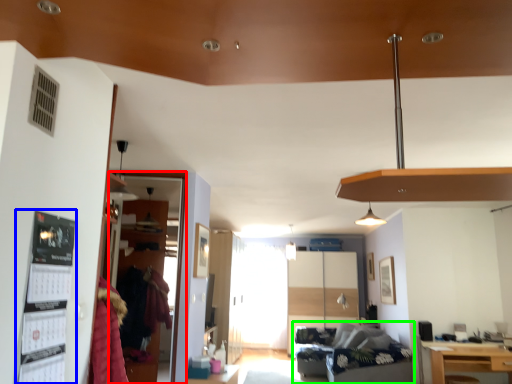
Question: Based on their relative distances, which object is farther from glass door (highlighted by a red box)? Choose from bulletin board (highlighted by a blue box) and studio couch (highlighted by a green box).

Choices:
 (A) bulletin board
 (B) studio couch

Answer: (B)